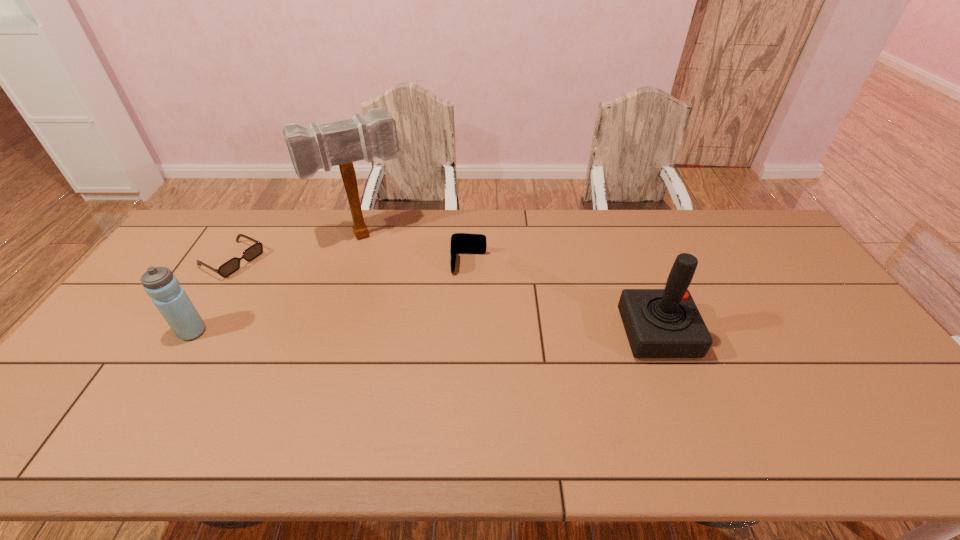
Find the location of a particular element. blank space located 0.070m on the outer surface of the fourth tallest object is located at coordinates (468, 292).

Find the location of a particular element. This screenshot has height=540, width=960. vacant area located 0.210m on the outer surface of the fourth tallest object is located at coordinates (466, 327).

The width and height of the screenshot is (960, 540). I want to click on vacant space located 0.400m at the head of the third object from left to right, so click(x=420, y=337).

Identify the location of vacant region located at the head of the third object from left to right. The image size is (960, 540). (395, 285).

Image resolution: width=960 pixels, height=540 pixels. I want to click on vacant space located 0.320m at the head of the third object from left to right, so click(411, 317).

Where is `free region located 0.240m on the front-facing side of the sunglasses`? The width and height of the screenshot is (960, 540). free region located 0.240m on the front-facing side of the sunglasses is located at coordinates (305, 299).

I want to click on vacant space located 0.070m on the front-facing side of the sunglasses, so click(266, 279).

Image resolution: width=960 pixels, height=540 pixels. Find the location of `vacant space situated on the front-facing side of the sunglasses`. vacant space situated on the front-facing side of the sunglasses is located at coordinates (327, 310).

Locate an element on the screen. This screenshot has height=540, width=960. mallet that is at the far edge is located at coordinates (341, 143).

Where is `sunglasses that is at the far edge`? sunglasses that is at the far edge is located at coordinates (231, 266).